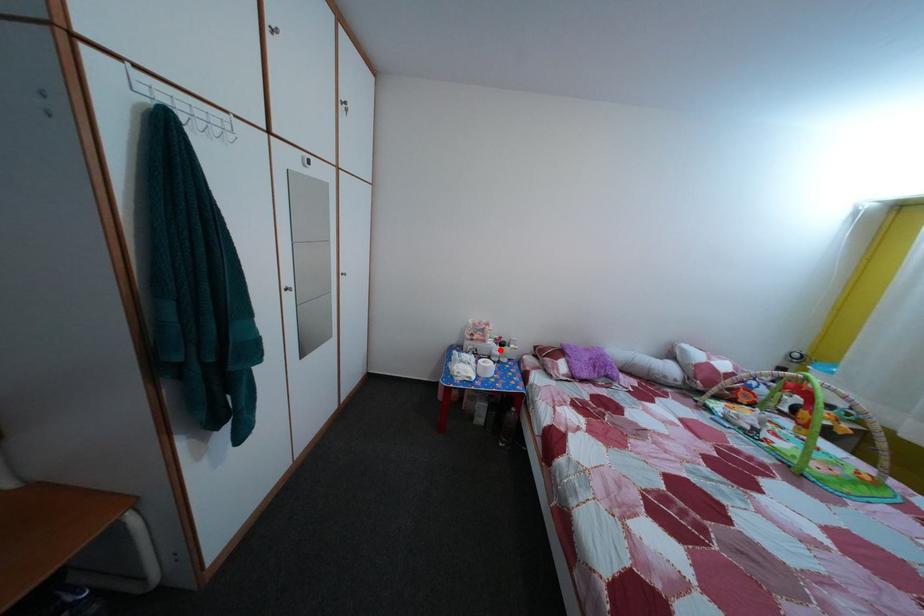
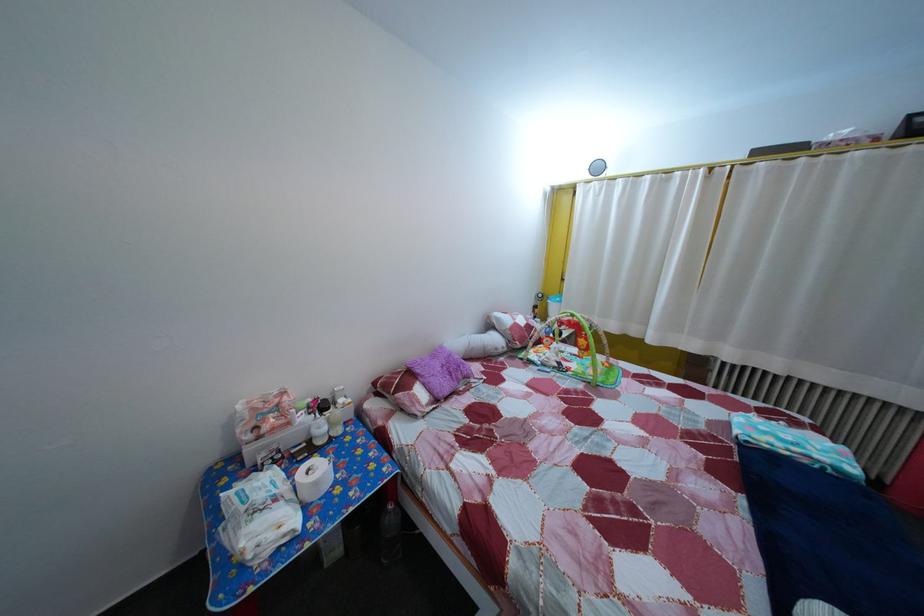
Question: I am providing you with two images of the same scene from different viewpoints. A red point is marked on the first image. Is the red point's position out of view in image 2?

Choices:
 (A) Yes
 (B) No

Answer: (B)